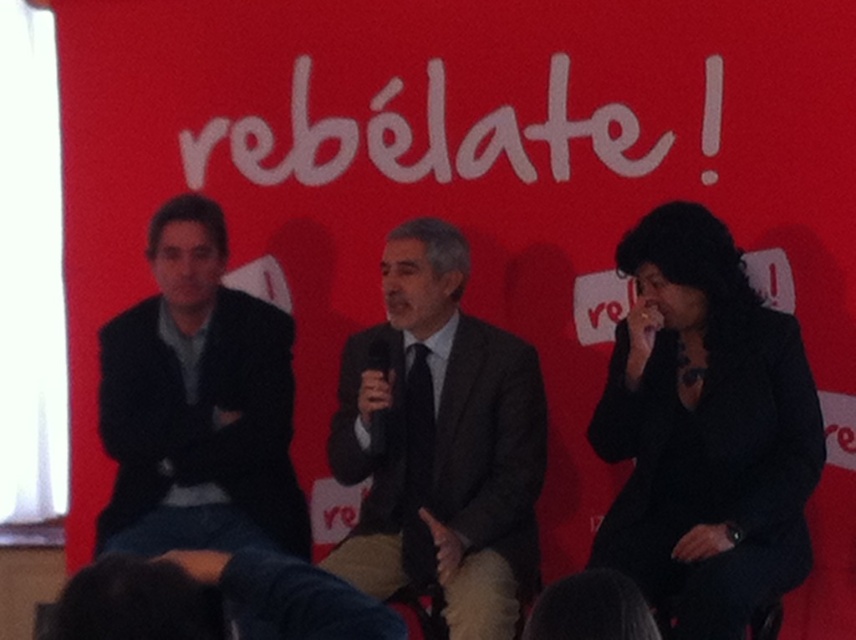
Which is more to the left, black fabric at right or dark gray suit at left?

dark gray suit at left

Which is in front, point (705, 269) or point (277, 444)?

Point (705, 269) is in front.

You are a GUI agent. You are given a task and a screenshot of the screen. Output one action in this format:
    pyautogui.click(x=<x>, y=<y>)
    Task: Click on the black fabric at right
    
    Given the screenshot: What is the action you would take?
    pyautogui.click(x=705, y=429)

Who is lower down, dark gray suit at center or white matte text at center?

dark gray suit at center

Which is behind, point (450, 349) or point (513, 112)?

Positioned behind is point (513, 112).

You are a GUI agent. You are given a task and a screenshot of the screen. Output one action in this format:
    pyautogui.click(x=<x>, y=<y>)
    Task: Click on the dark gray suit at center
    
    Given the screenshot: What is the action you would take?
    pyautogui.click(x=443, y=444)

Between black fabric at right and white matte text at center, which one appears on the right side from the viewer's perspective?

black fabric at right

Is black fabric at right shorter than white matte text at center?

In fact, black fabric at right may be taller than white matte text at center.

Which is in front, point (663, 214) or point (336, 140)?

Positioned in front is point (663, 214).

The width and height of the screenshot is (856, 640). Find the location of `black fabric at right`. black fabric at right is located at coordinates (705, 429).